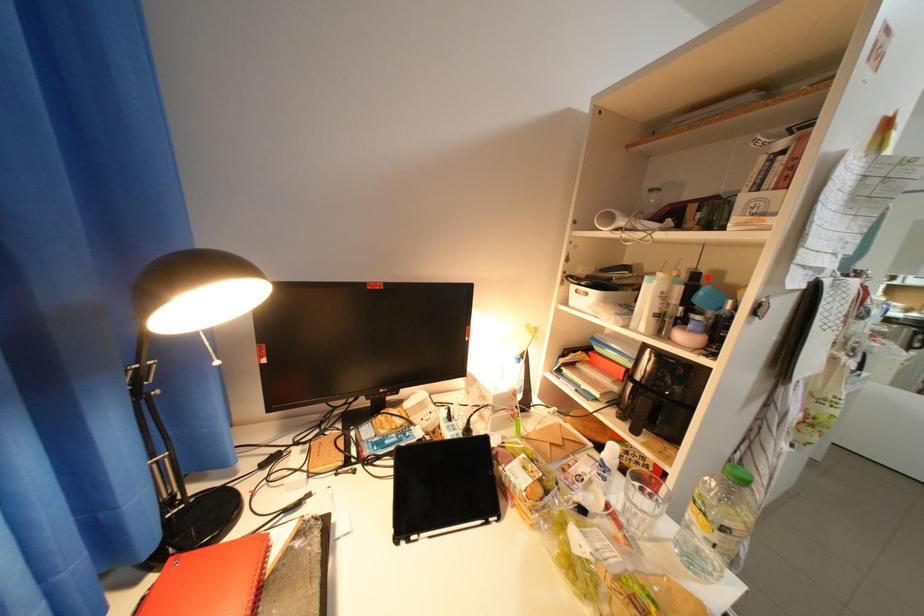
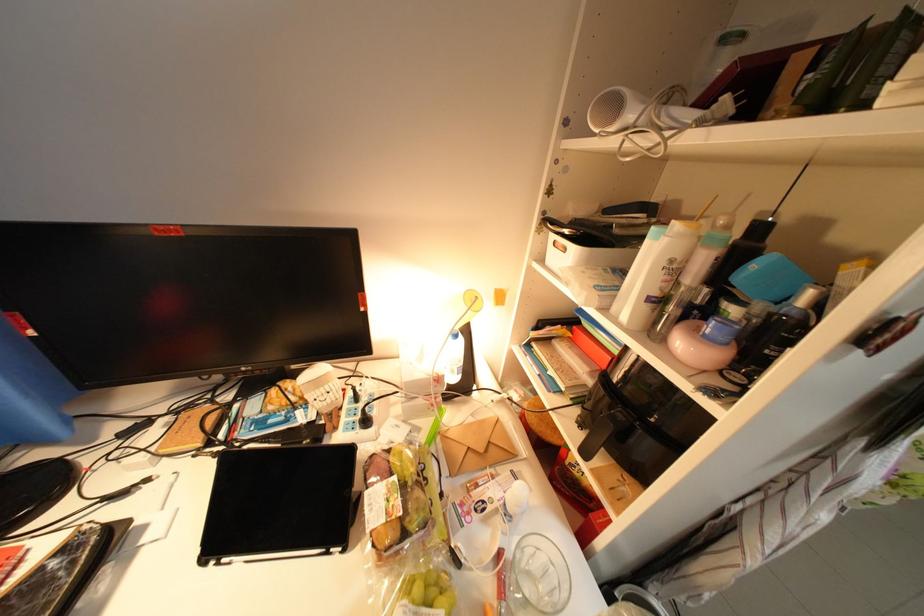
Find the pixel in the second image that matches the highlighted location in the first image.

(772, 230)